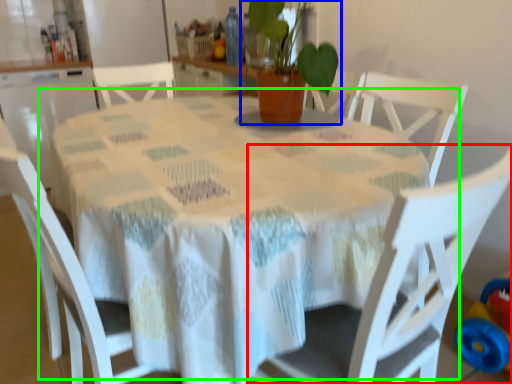
Question: Estimate the real-world distances between objects in this image. Which object is closer to chair (highlighted by a red box), houseplant (highlighted by a blue box) or table (highlighted by a green box)?

Choices:
 (A) houseplant
 (B) table

Answer: (B)